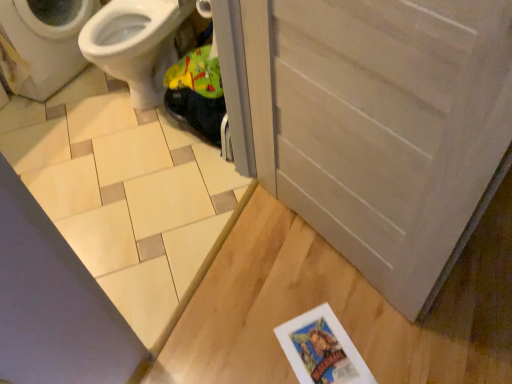
Question: Is white glossy bidet at upper left positioned beyond the bounds of beige ceramic tile at lower left?

Choices:
 (A) yes
 (B) no

Answer: (A)

Question: From the image's perspective, is white glossy bidet at upper left under beige ceramic tile at lower left?

Choices:
 (A) yes
 (B) no

Answer: (B)

Question: Is white glossy bidet at upper left thinner than beige ceramic tile at lower left?

Choices:
 (A) yes
 (B) no

Answer: (A)

Question: Could you tell me if white glossy bidet at upper left is turned towards beige ceramic tile at lower left?

Choices:
 (A) yes
 (B) no

Answer: (A)

Question: Is white glossy bidet at upper left at the right side of beige ceramic tile at lower left?

Choices:
 (A) yes
 (B) no

Answer: (A)

Question: From their relative heights in the image, would you say beige ceramic tile at lower left is taller or shorter than white matte screen door at lower right?

Choices:
 (A) short
 (B) tall

Answer: (A)

Question: Does point (218, 195) appear closer or farther from the camera than point (425, 34)?

Choices:
 (A) closer
 (B) farther

Answer: (B)

Question: From a real-world perspective, relative to white matte screen door at lower right, is beige ceramic tile at lower left vertically above or below?

Choices:
 (A) above
 (B) below

Answer: (B)

Question: Looking at the image, does beige ceramic tile at lower left seem bigger or smaller compared to white matte screen door at lower right?

Choices:
 (A) big
 (B) small

Answer: (A)

Question: Is white matte screen door at lower right taller or shorter than beige ceramic tile at lower left?

Choices:
 (A) short
 (B) tall

Answer: (B)

Question: Visually, is white matte screen door at lower right positioned to the left or to the right of beige ceramic tile at lower left?

Choices:
 (A) right
 (B) left

Answer: (A)

Question: Considering the positions of point (412, 107) and point (69, 213), is point (412, 107) closer or farther from the camera than point (69, 213)?

Choices:
 (A) closer
 (B) farther

Answer: (A)

Question: In the image, is white matte screen door at lower right positioned in front of or behind beige ceramic tile at lower left?

Choices:
 (A) front
 (B) behind

Answer: (A)

Question: Is white glossy bidet at upper left wider or thinner than beige ceramic tile at lower left?

Choices:
 (A) thin
 (B) wide

Answer: (A)

Question: In terms of size, does white glossy bidet at upper left appear bigger or smaller than beige ceramic tile at lower left?

Choices:
 (A) big
 (B) small

Answer: (A)